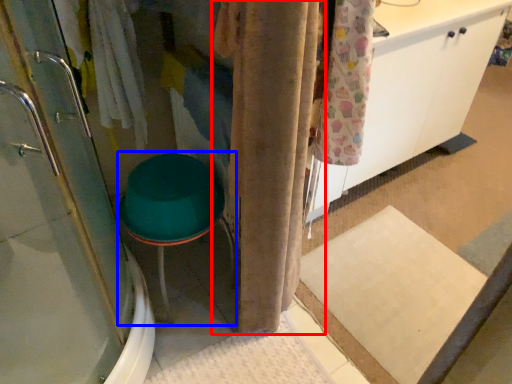
Question: Which object is further to the camera taking this photo, curtain (highlighted by a red box) or step stool (highlighted by a blue box)?

Choices:
 (A) curtain
 (B) step stool

Answer: (B)